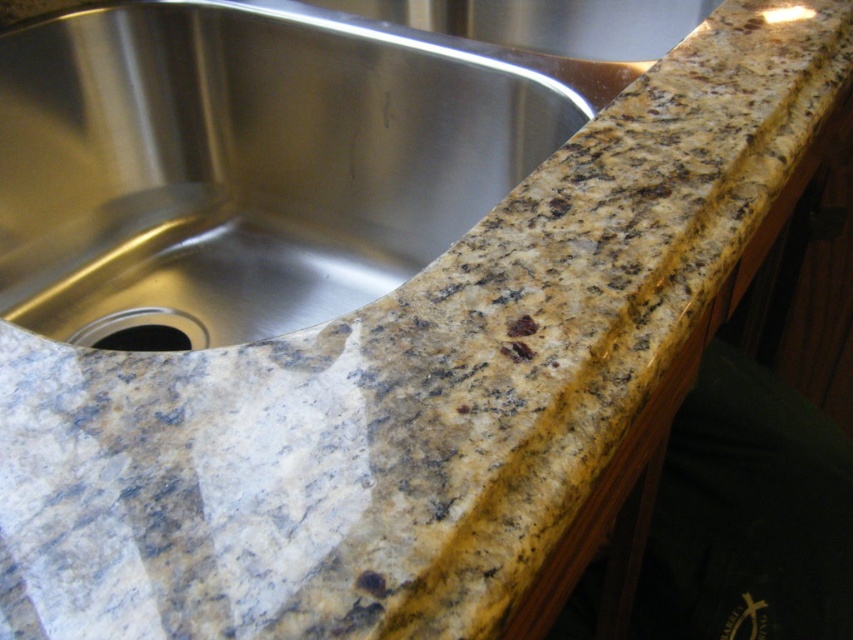
Question: Which object is farther from the camera taking this photo?

Choices:
 (A) black granite drain at lower left
 (B) stainless steel sink at upper left

Answer: (A)

Question: Among these objects, which one is nearest to the camera?

Choices:
 (A) black granite drain at lower left
 (B) stainless steel sink at upper left

Answer: (B)

Question: Is stainless steel sink at upper left above black granite drain at lower left?

Choices:
 (A) no
 (B) yes

Answer: (B)

Question: Can you confirm if stainless steel sink at upper left is bigger than black granite drain at lower left?

Choices:
 (A) no
 (B) yes

Answer: (B)

Question: Among these objects, which one is nearest to the camera?

Choices:
 (A) black granite drain at lower left
 (B) stainless steel sink at upper left

Answer: (B)

Question: Does stainless steel sink at upper left appear under black granite drain at lower left?

Choices:
 (A) no
 (B) yes

Answer: (A)